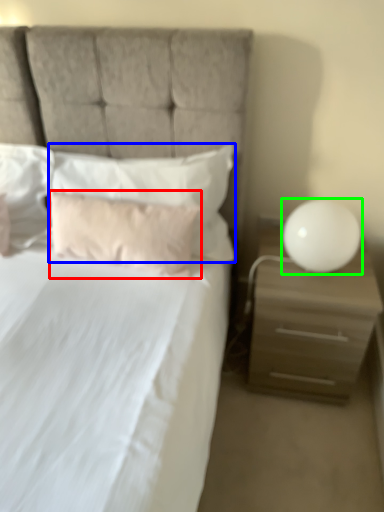
Question: Which is farther away from pillow (highlighted by a red box)? pillow (highlighted by a blue box) or table lamp (highlighted by a green box)?

Choices:
 (A) pillow
 (B) table lamp

Answer: (B)